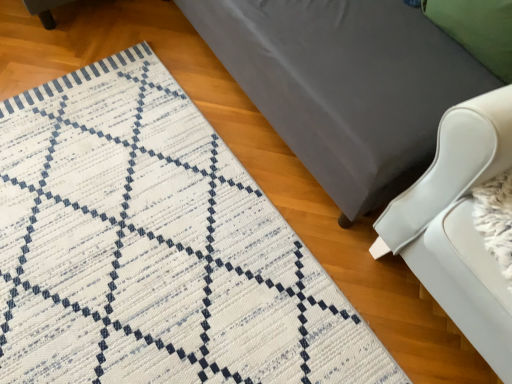
Question: Is white woven mat at lower left facing away from matte gray bed at center?

Choices:
 (A) no
 (B) yes

Answer: (A)

Question: From a real-world perspective, is white woven mat at lower left on matte gray bed at center?

Choices:
 (A) yes
 (B) no

Answer: (B)

Question: Is white woven mat at lower left thinner than matte gray bed at center?

Choices:
 (A) no
 (B) yes

Answer: (A)

Question: From a real-world perspective, is white woven mat at lower left positioned under matte gray bed at center based on gravity?

Choices:
 (A) yes
 (B) no

Answer: (A)

Question: Is white woven mat at lower left smaller than matte gray bed at center?

Choices:
 (A) no
 (B) yes

Answer: (B)

Question: In terms of width, does matte gray bed at center look wider or thinner when compared to white woven mat at lower left?

Choices:
 (A) wide
 (B) thin

Answer: (B)

Question: In the image, is matte gray bed at center on the left side or the right side of white woven mat at lower left?

Choices:
 (A) right
 (B) left

Answer: (A)

Question: From the image's perspective, is matte gray bed at center located above or below white woven mat at lower left?

Choices:
 (A) above
 (B) below

Answer: (A)

Question: In terms of size, does matte gray bed at center appear bigger or smaller than white woven mat at lower left?

Choices:
 (A) small
 (B) big

Answer: (B)

Question: Relative to matte gray bed at center, is green fabric pillow at upper right in front or behind?

Choices:
 (A) front
 (B) behind

Answer: (B)

Question: Considering the positions of point (466, 26) and point (266, 107), is point (466, 26) closer or farther from the camera than point (266, 107)?

Choices:
 (A) closer
 (B) farther

Answer: (A)

Question: Based on their positions, is green fabric pillow at upper right located to the left or right of matte gray bed at center?

Choices:
 (A) right
 (B) left

Answer: (A)

Question: From the image's perspective, is green fabric pillow at upper right positioned above or below matte gray bed at center?

Choices:
 (A) above
 (B) below

Answer: (B)

Question: Would you say green fabric pillow at upper right is to the left or to the right of white woven mat at lower left in the picture?

Choices:
 (A) left
 (B) right

Answer: (B)

Question: Would you say green fabric pillow at upper right is inside or outside white woven mat at lower left?

Choices:
 (A) inside
 (B) outside

Answer: (B)